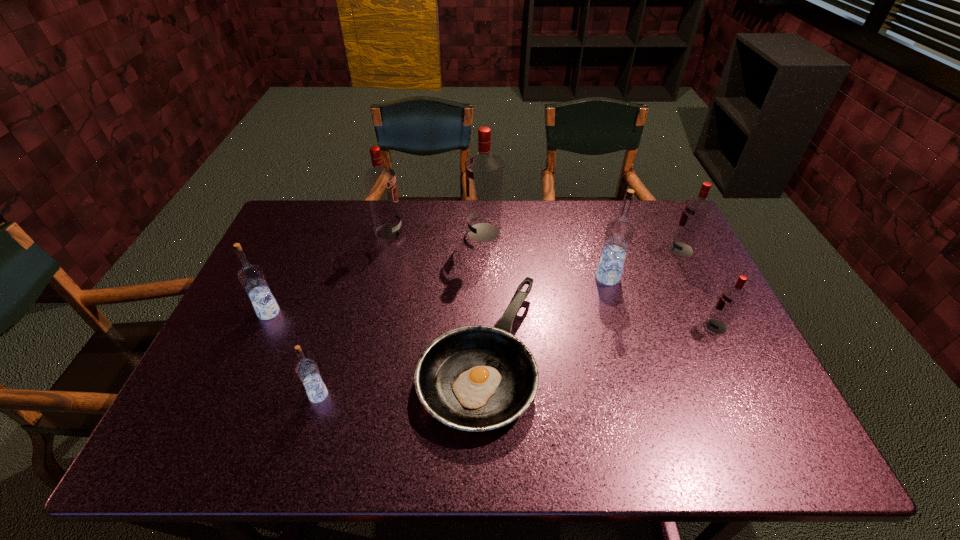
What are the coordinates of `object at the far right corner` in the screenshot? It's located at 696,211.

Where is `vacant space at the far edge of the desktop`? This screenshot has height=540, width=960. vacant space at the far edge of the desktop is located at coordinates [582, 210].

The width and height of the screenshot is (960, 540). What are the coordinates of `vacant space at the near edge` in the screenshot? It's located at (543, 437).

Where is `free space at the left edge`? free space at the left edge is located at coordinates (224, 339).

Find the location of a particular element. vacant space at the right edge of the desktop is located at coordinates (670, 266).

Identify the location of vacant area at the far left corner. (318, 205).

This screenshot has height=540, width=960. What are the coordinates of `vacant region at the far right corner of the desktop` in the screenshot? It's located at (649, 210).

In the image, there is a desktop. Identify the location of vacant space at the near right corner. (768, 441).

The height and width of the screenshot is (540, 960). Find the location of `vacant region between the frying pan and the third object from left to right`. vacant region between the frying pan and the third object from left to right is located at coordinates (434, 293).

Locate an element on the screen. vacant space that's between the biggest blue vodka and the nearest red vodka is located at coordinates (662, 302).